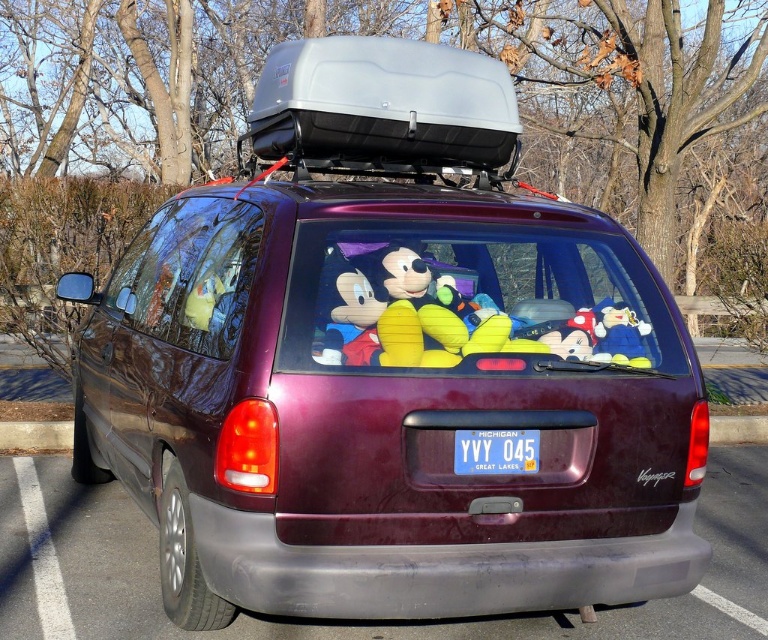
Question: Can you confirm if maroon metallic van at center is smaller than gray plastic cargo box at center?

Choices:
 (A) yes
 (B) no

Answer: (B)

Question: Does maroon metallic van at center have a smaller size compared to blue plastic license plate at center?

Choices:
 (A) yes
 (B) no

Answer: (B)

Question: Among these objects, which one is farthest from the camera?

Choices:
 (A) gray plastic cargo box at center
 (B) blue plastic license plate at center

Answer: (A)

Question: Among these objects, which one is nearest to the camera?

Choices:
 (A) blue plastic license plate at center
 (B) maroon metallic van at center

Answer: (B)

Question: Which of the following is the farthest from the observer?

Choices:
 (A) (366, 456)
 (B) (290, 65)
 (C) (505, 433)

Answer: (B)

Question: Can you confirm if maroon metallic van at center is thinner than gray plastic cargo box at center?

Choices:
 (A) no
 (B) yes

Answer: (A)